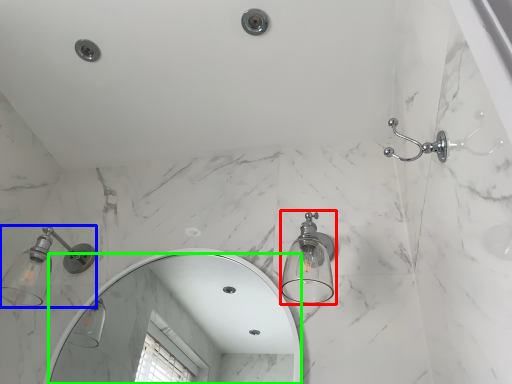
Question: Which is nearer to the light fixture (highlighted by a red box)? light fixture (highlighted by a blue box) or mirror (highlighted by a green box).

Choices:
 (A) light fixture
 (B) mirror

Answer: (A)